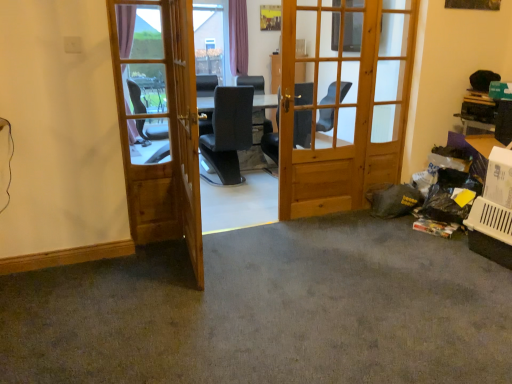
Identify the location of empty space that is to the right of light brown wooden screen door at center. (257, 263).